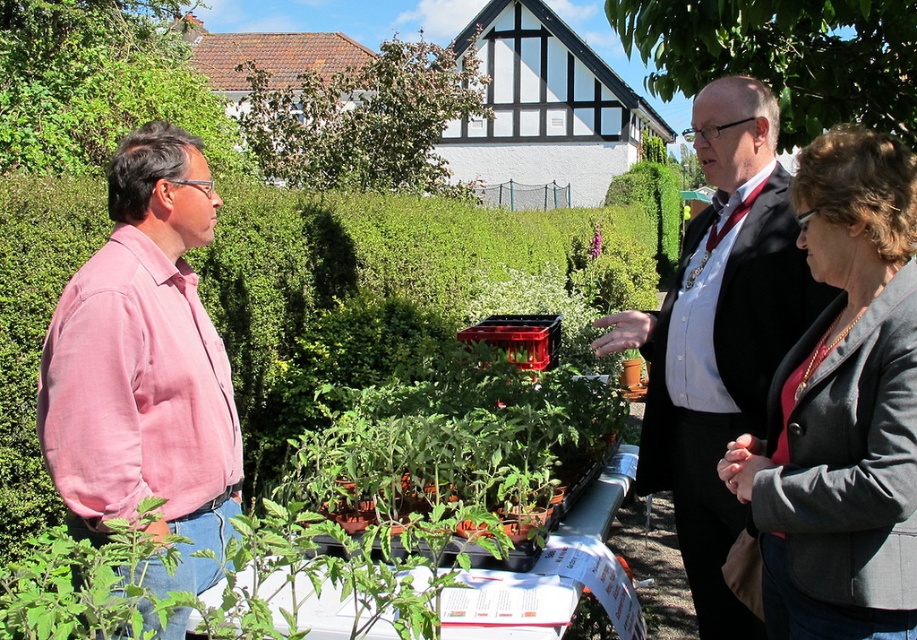
You are a photographer trying to capture a group photo of the pink cotton shirt at left and the black suit at center. Since you want to include both subjects in the frame, where should you position yourself relative to the two people?

You should position yourself to the right of both the pink cotton shirt at left and the black suit at center so that both subjects can be included in the frame. Since the pink cotton shirt at left is to the left of the black suit at center, standing to their right would allow you to see both individuals without any obstruction.

Based on the coordinates provided, which object is located at point (843,406)?

The gray wool blazer at center is located at point (843,406).

You are a photographer trying to capture a group photo of the people in the scene. The camera you are using has a rectangular frame with coordinates ranging from 0 to 1 on both the x and y axes. The photographer wants to ensure that the gray wool blazer at center is centered in the frame. What are the coordinates of the center of the camera frame to achieve this?

The gray wool blazer at center is positioned at point (843, 406). To center it in the camera frame, the center coordinates should be set to 0.637 on the x axis and 0.920 on the y axis.